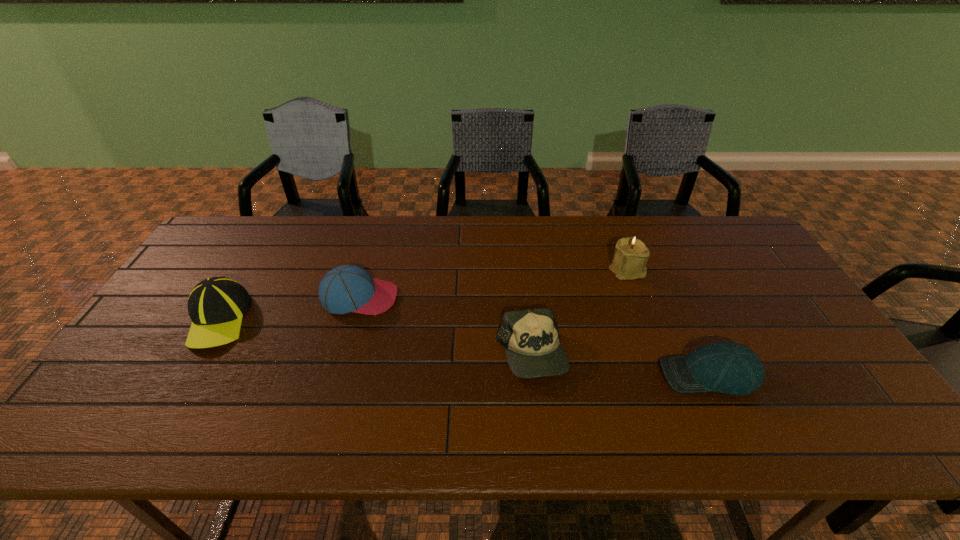
Where is `candle_holder`? This screenshot has width=960, height=540. candle_holder is located at coordinates (629, 261).

This screenshot has height=540, width=960. I want to click on the fourth object from right to left, so 348,288.

What are the coordinates of `the leftmost baseball cap` in the screenshot? It's located at (216, 305).

I want to click on the rightmost baseball cap, so click(732, 368).

Where is `the second baseball cap from right to left`? The width and height of the screenshot is (960, 540). the second baseball cap from right to left is located at coordinates (531, 338).

Where is `blank space located on the left of the candle_holder`? The height and width of the screenshot is (540, 960). blank space located on the left of the candle_holder is located at coordinates click(555, 270).

You are a GUI agent. You are given a task and a screenshot of the screen. Output one action in this format:
    pyautogui.click(x=<x>, y=<y>)
    Task: Click on the vacant space located on the front-facing side of the fourth object from right to left
    
    Given the screenshot: What is the action you would take?
    pyautogui.click(x=517, y=298)

What are the coordinates of `free space located 0.050m with the brim of the leftmost baseball cap facing forward` in the screenshot? It's located at (189, 369).

Where is `vacant region located on the back of the rightmost baseball cap`? The image size is (960, 540). vacant region located on the back of the rightmost baseball cap is located at coordinates (675, 301).

The image size is (960, 540). Find the location of `vacant space located 0.060m on the front-facing side of the third baseball cap from left to right`. vacant space located 0.060m on the front-facing side of the third baseball cap from left to right is located at coordinates (537, 407).